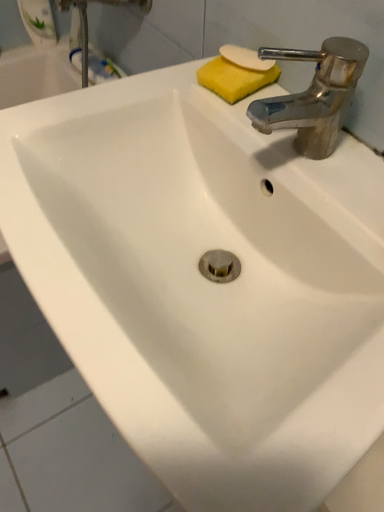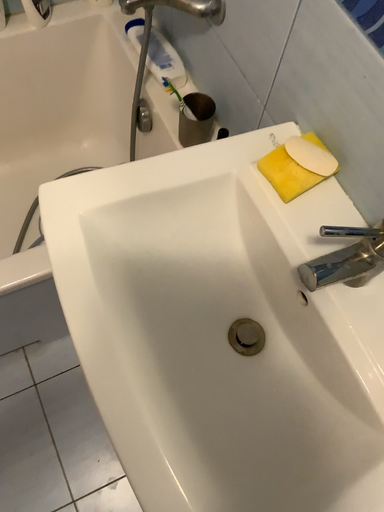
Question: How did the camera likely rotate when shooting the video?

Choices:
 (A) rotated upward
 (B) rotated downward

Answer: (B)